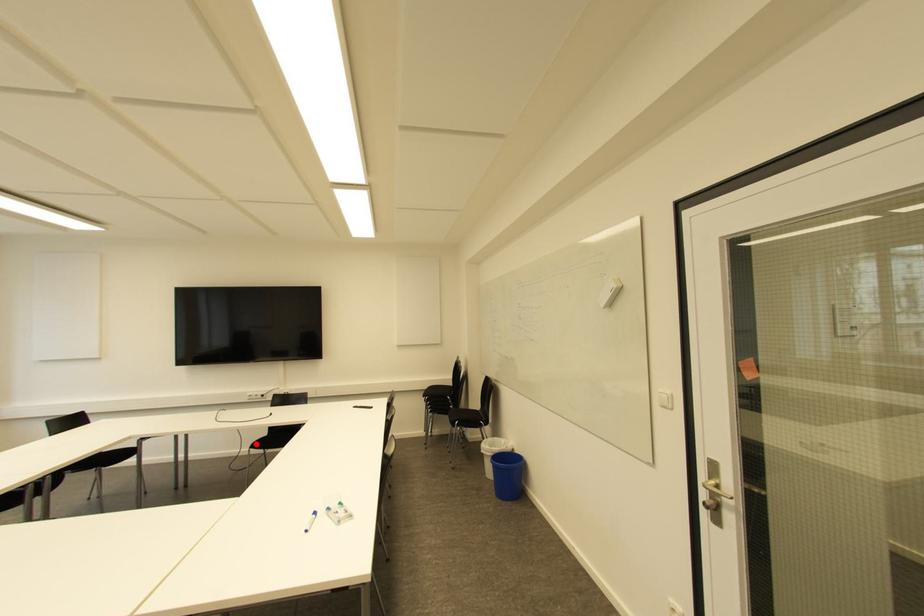
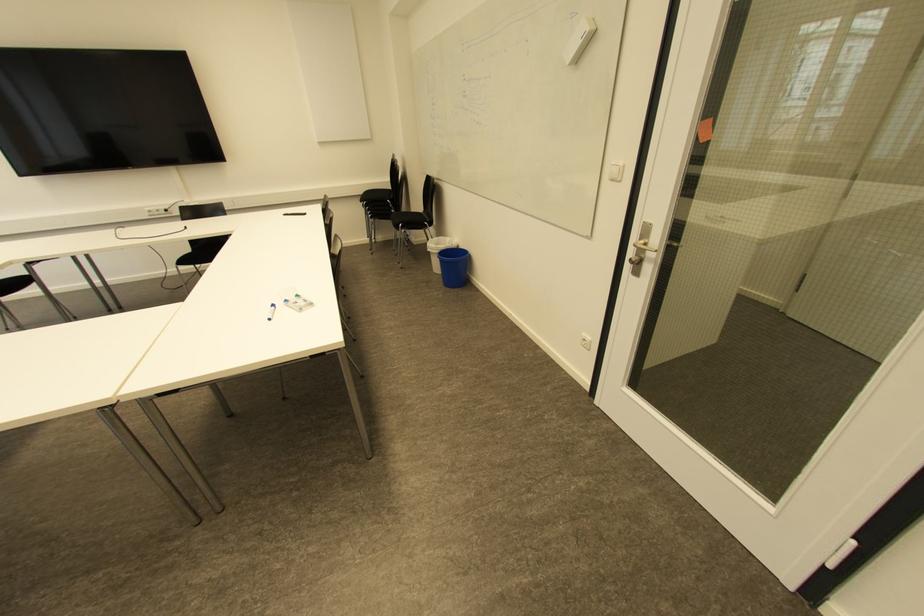
In the second image, find the point that corresponds to the highlighted location in the first image.

(183, 261)